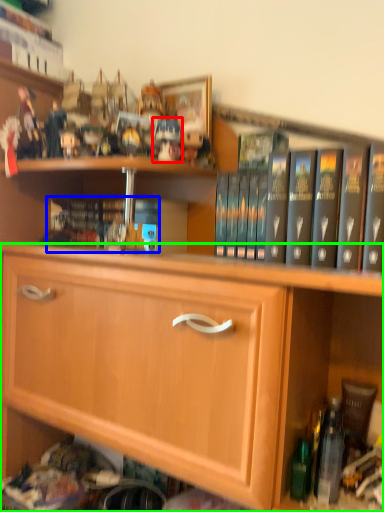
Question: Which object is the closest to the toy (highlighted by a red box)? Choose among these: book (highlighted by a blue box) or cabinetry (highlighted by a green box).

Choices:
 (A) book
 (B) cabinetry

Answer: (A)